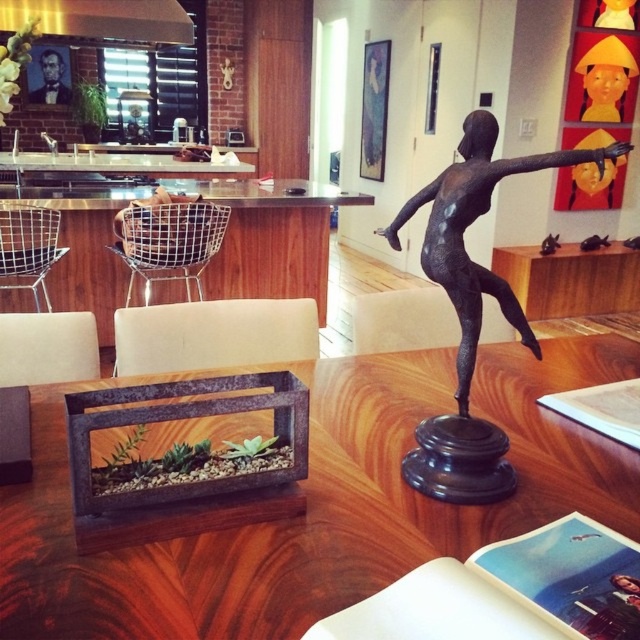
Is metal mesh chair at center taller than wire mesh chair at left?

Yes.

Based on the photo, who is more forward, [182,204] or [1,243]?

Positioned in front is point [1,243].

Locate an element on the screen. metal mesh chair at center is located at coordinates (168, 241).

Which is above, bronze statue at center or beige fabric chair at center?

bronze statue at center

Measure the distance between bronze statue at center and beige fabric chair at center.

bronze statue at center and beige fabric chair at center are 1.04 meters apart from each other.

In the scene shown: Who is more forward, [474,179] or [51,339]?

Point [474,179]

The width and height of the screenshot is (640, 640). In order to click on bronze statue at center in this screenshot , I will do `click(472, 308)`.

Can you confirm if wire mesh chair at left is wider than yellow paper hat at upper right?

No.

Which is above, wire mesh chair at left or yellow paper hat at upper right?

yellow paper hat at upper right is above.

Is point (45, 250) positioned before point (593, 104)?

That is True.

This screenshot has height=640, width=640. Find the location of `wire mesh chair at left`. wire mesh chair at left is located at coordinates (28, 248).